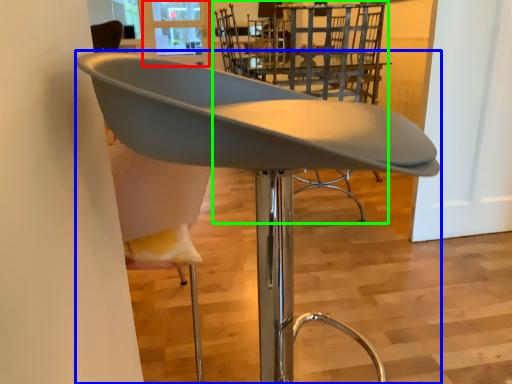
Question: Which object is positioned closest to window screen (highlighted by a red box)? Select from chair (highlighted by a blue box) and chair (highlighted by a green box).

Choices:
 (A) chair
 (B) chair

Answer: (B)